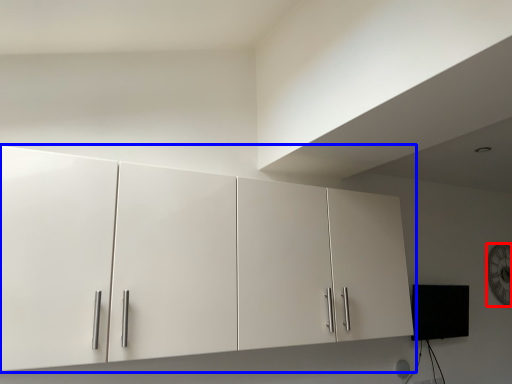
Question: Among these objects, which one is farthest to the camera, clock (highlighted by a red box) or cupboard (highlighted by a blue box)?

Choices:
 (A) clock
 (B) cupboard

Answer: (A)